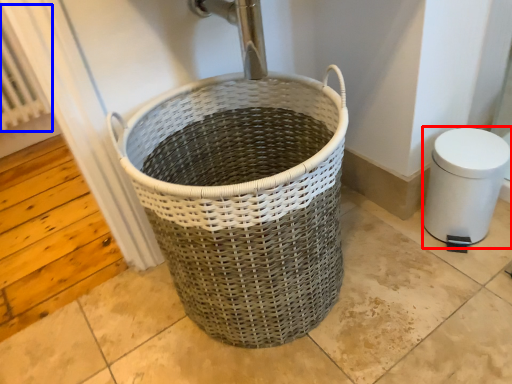
Question: Among these objects, which one is farthest to the camera, bidet (highlighted by a red box) or radiator (highlighted by a blue box)?

Choices:
 (A) bidet
 (B) radiator

Answer: (B)